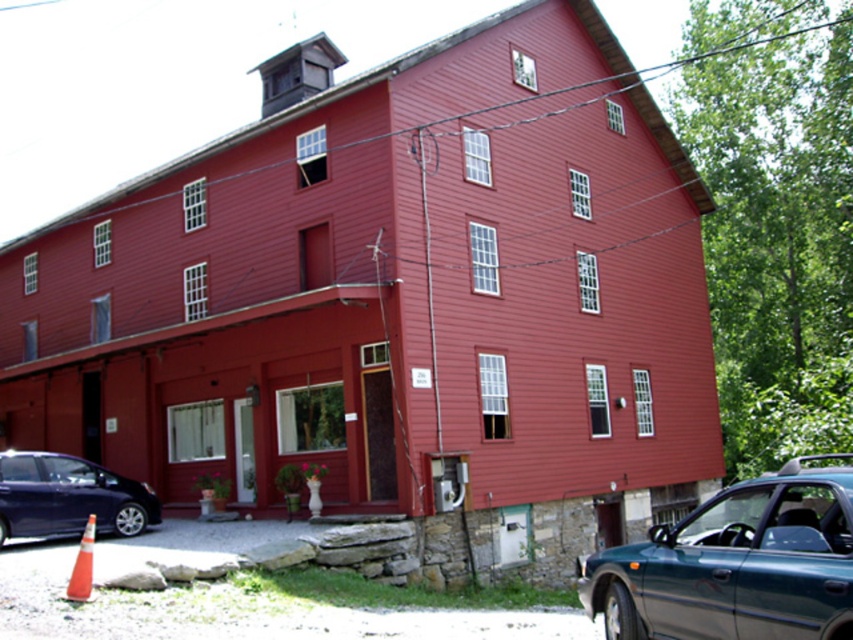
Question: Which object is closer to the camera taking this photo?

Choices:
 (A) orange reflective cone at lower left
 (B) metallic blue car at lower left

Answer: (A)

Question: Which object appears farthest from the camera in this image?

Choices:
 (A) orange reflective cone at lower left
 (B) metallic blue car at lower left

Answer: (B)

Question: Can you confirm if green matte car at lower right is positioned to the left of metallic blue car at lower left?

Choices:
 (A) yes
 (B) no

Answer: (B)

Question: Estimate the real-world distances between objects in this image. Which object is closer to the metallic blue car at lower left?

Choices:
 (A) green matte car at lower right
 (B) orange reflective cone at lower left

Answer: (B)

Question: Can you confirm if green matte car at lower right is smaller than orange reflective cone at lower left?

Choices:
 (A) yes
 (B) no

Answer: (B)

Question: Where is green matte car at lower right located in relation to orange reflective cone at lower left in the image?

Choices:
 (A) above
 (B) below

Answer: (B)